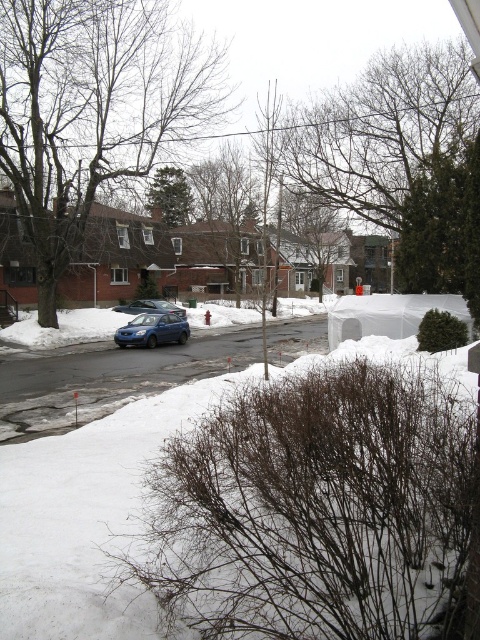
You are a delivery person needing to park your vehicle. You see the white fluffy snow at lower left and the satin blue sedan at center. How far apart are these two objects?

The white fluffy snow at lower left and the satin blue sedan at center are 19.90 meters apart.

You are standing at the point with coordinates point (165, 300) and want to walk to the point with coordinates point (96, 627). Which direction should you face to walk straight towards your destination?

You should face north because point (96, 627) is in front of point (165, 300), indicating it is north of your current position.

You are a delivery person who needs to park your vehicle near the matte blue van at center. The parking space must be at least 15 meters away from any snowdrifts to avoid getting stuck. Is the parking spot near the white fluffy snow at lower left suitable?

The white fluffy snow at lower left is 13.67 meters away from the matte blue van at center. Since the required distance is 15 meters, the parking spot is too close to the snowdrift and not suitable.